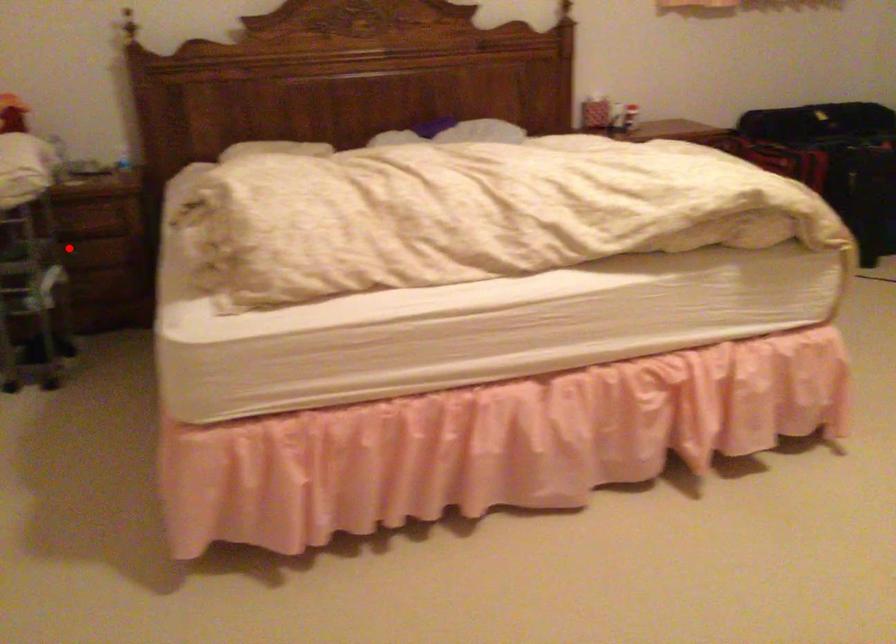
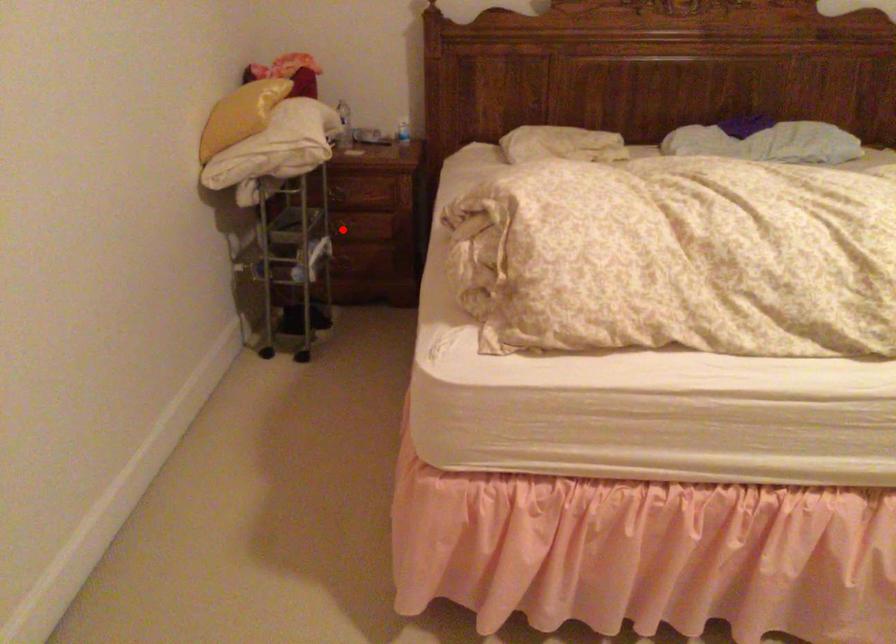
I am providing you with two images of the same scene from different viewpoints. A red point is marked on the first image and another point is marked on the second image. Does the point marked in image1 correspond to the same location as the one in image2?

Yes